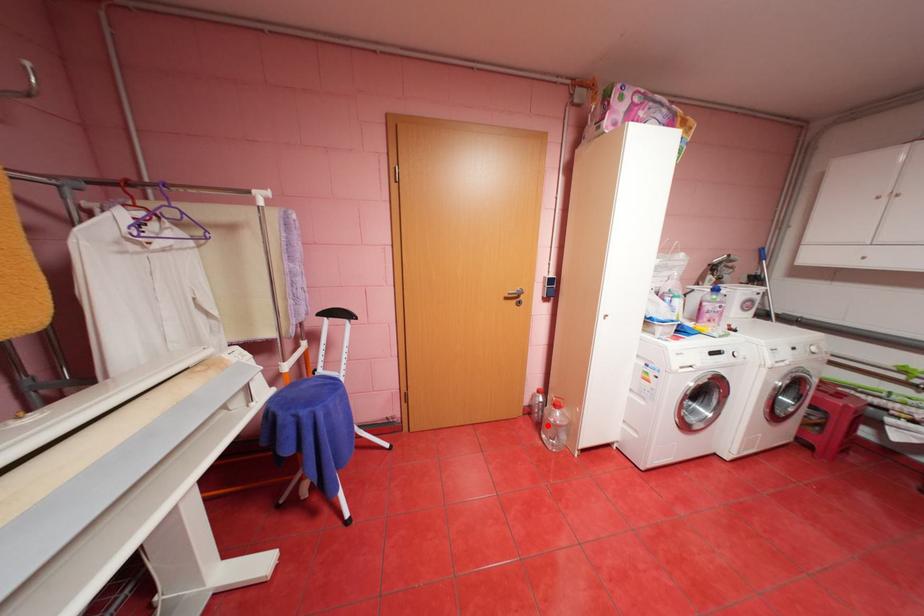
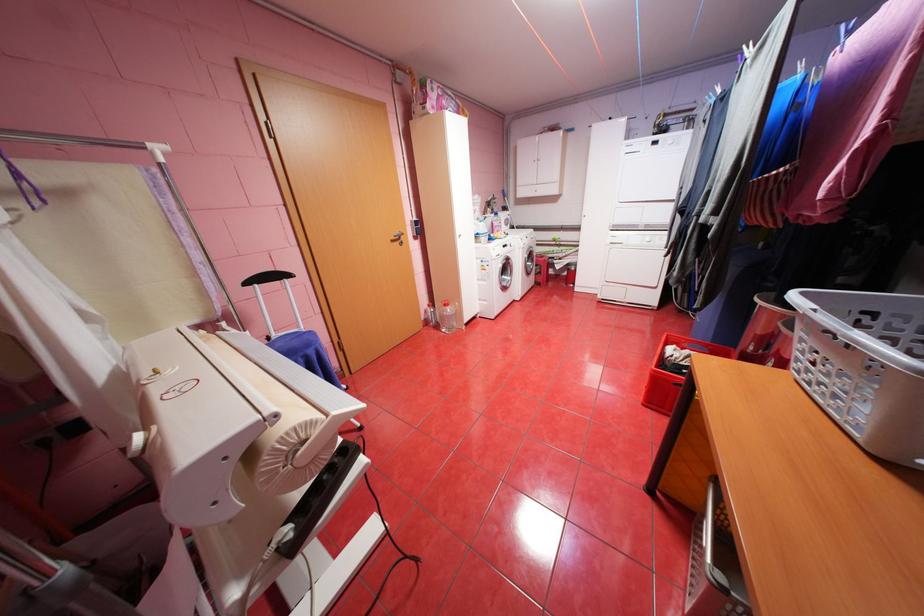
Question: I am providing you with two images of the same scene from different viewpoints. In image1, a red point is highlighted. Considering the same 3D point in image2, which of the following is correct?

Choices:
 (A) It is closer
 (B) It is farther

Answer: (B)